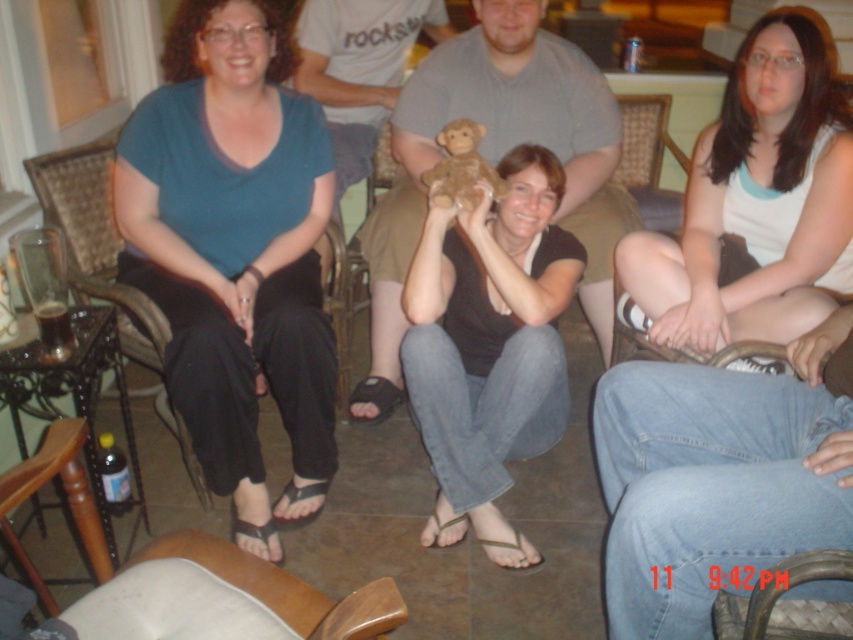
Can you confirm if gray cotton shirt at center is positioned above brown plush monkey at center?

Incorrect, gray cotton shirt at center is not positioned above brown plush monkey at center.

Is point (379, 273) closer to camera compared to point (459, 182)?

No, it is behind (459, 182).

The width and height of the screenshot is (853, 640). I want to click on gray cotton shirt at center, so click(x=495, y=163).

Who is positioned more to the left, black matte shirt at center or white cotton tank top at center?

From the viewer's perspective, black matte shirt at center appears more on the left side.

Between point (416, 408) and point (840, 195), which one is positioned in front?

Point (416, 408) is more forward.

Locate an element on the screen. The image size is (853, 640). black matte shirt at center is located at coordinates (489, 346).

Does point (819, 628) come in front of point (680, 211)?

Yes.

In the scene shown: Which of these two, woven leather chair at lower center or woven wood chair at center, stands shorter?

woven leather chair at lower center is shorter.

Which is behind, point (786, 568) or point (637, 160)?

The point (637, 160) is more distant.

You are a GUI agent. You are given a task and a screenshot of the screen. Output one action in this format:
    pyautogui.click(x=<x>, y=<y>)
    Task: Click on the woven leather chair at lower center
    
    Given the screenshot: What is the action you would take?
    pyautogui.click(x=778, y=616)